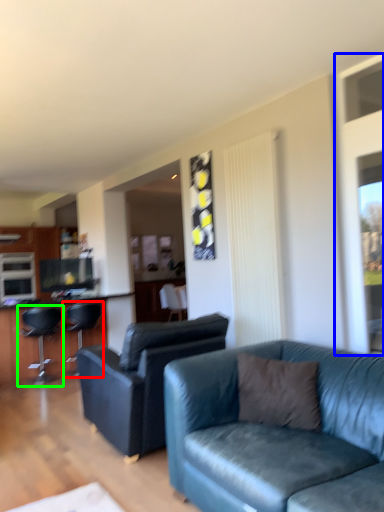
Question: Based on their relative distances, which object is nearer to chair (highlighted by a red box)? Choose from window screen (highlighted by a blue box) and chair (highlighted by a green box).

Choices:
 (A) window screen
 (B) chair

Answer: (B)